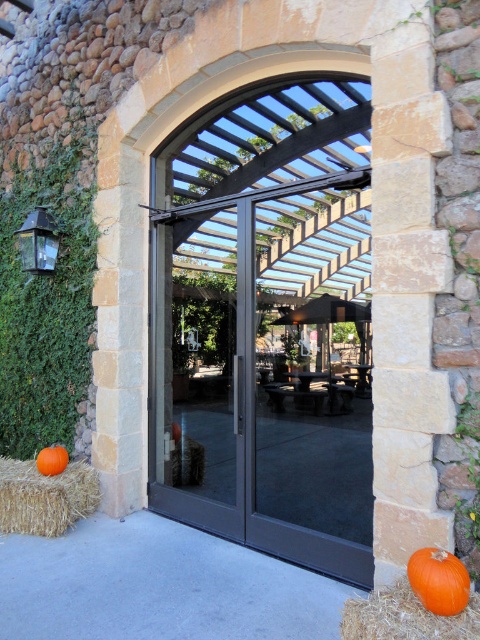
You are planning to place a small decorative statue on the patio. The statue is 10 inches tall. Considering the orange hay at lower right and the orange matte pumpkin at lower right, which object would you place the statue on to ensure it is visible above both?

The orange hay at lower right is much taller than the orange matte pumpkin at lower right. To ensure the statue is visible above both, place it on the orange hay at lower right so it rises above the taller object.

You are standing at the entrance of the archway and want to enter the patio. You see the black glass door at center and the orange matte pumpkin at lower left. Which object is closer to you as you face the archway?

The black glass door at center is closer to you because it is in front of the orange matte pumpkin at lower left.

You are standing at the entrance of the archway and want to place a small potted plant. The potted plant has a diameter of 0.1 units. The point at coordinates point is (45,497) is on a straw bale at lower left. Where should you place the potted plant so that it doesn t overlap with any existing objects?

The potted plant should be placed away from the straw bale at lower left where the point is located to avoid overlapping with existing objects.